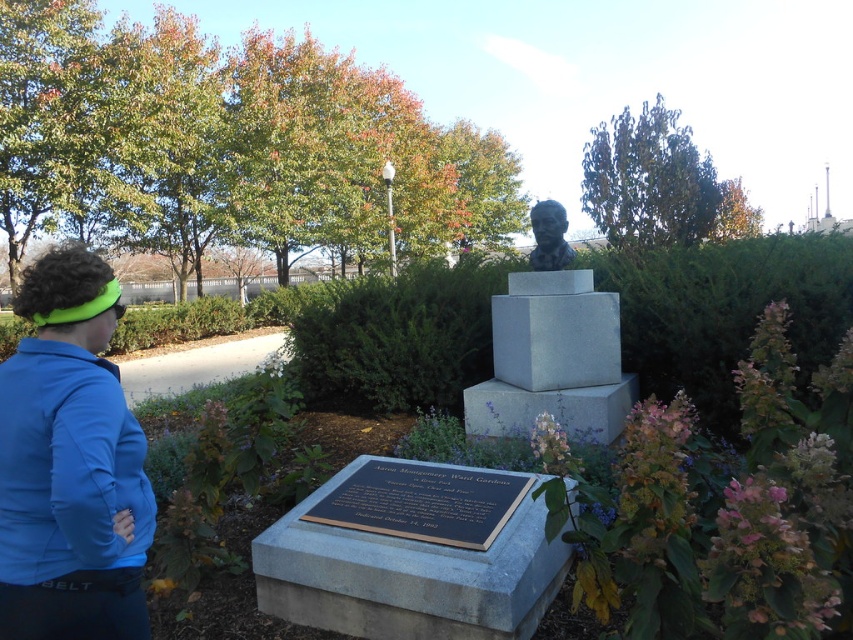
Question: Which point is closer to the camera?

Choices:
 (A) gray stone bust at center
 (B) bronze bust at center
 (C) slate gray bust at center

Answer: (C)

Question: Does slate gray bust at center appear on the left side of bronze bust at center?

Choices:
 (A) no
 (B) yes

Answer: (A)

Question: Among these points, which one is farthest from the camera?

Choices:
 (A) (422, 317)
 (B) (532, 218)
 (C) (102, 472)
 (D) (614, 356)

Answer: (A)

Question: Can you confirm if blue fabric jacket at lower left is smaller than slate gray bust at center?

Choices:
 (A) no
 (B) yes

Answer: (B)

Question: In this image, where is blue fabric jacket at lower left located relative to slate gray bust at center?

Choices:
 (A) below
 (B) above

Answer: (A)

Question: Which object appears farthest from the camera in this image?

Choices:
 (A) slate gray bust at center
 (B) bronze bust at center
 (C) blue fabric jacket at lower left

Answer: (B)